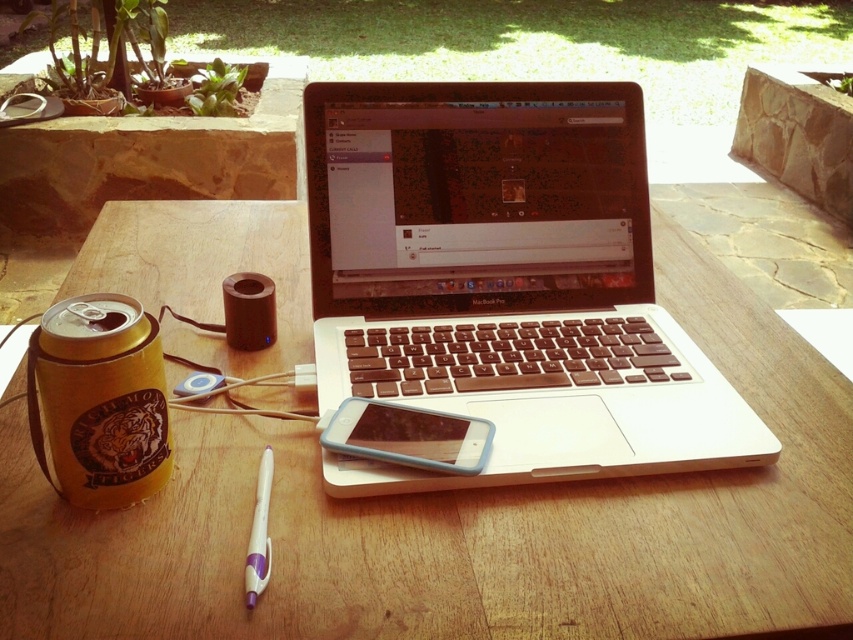
You are a delivery person standing at the entrance of the patio. You need to place a package on the white plastic laptop at center without touching it. Can you do this?

The white plastic laptop at center and viewer are 20.04 inches apart. Since you are a delivery person standing at the entrance of the patio, you can place the package on the white plastic laptop at center without touching it by carefully reaching or using a tool to place it from a distance of 20.04 inches.

You are setting up a video call on your laptop. You have a wooden table at center and a translucent plastic phone at center. Which object can you place the laptop on to ensure it is stable?

The wooden table at center is bigger than the translucent plastic phone at center, so you should place the laptop on the wooden table at center for stability.

You are sitting at the wooden table in the outdoor workspace and want to place a new item between the two points labeled as point (x=430, y=528) and point (x=613, y=323). Based on their positions, which point should the new item be closer to?

The new item should be closer to point (x=613, y=323) because point (x=430, y=528) is in front of it, meaning point (x=613, y=323) is further back and the midpoint between them would be closer to the rear point.